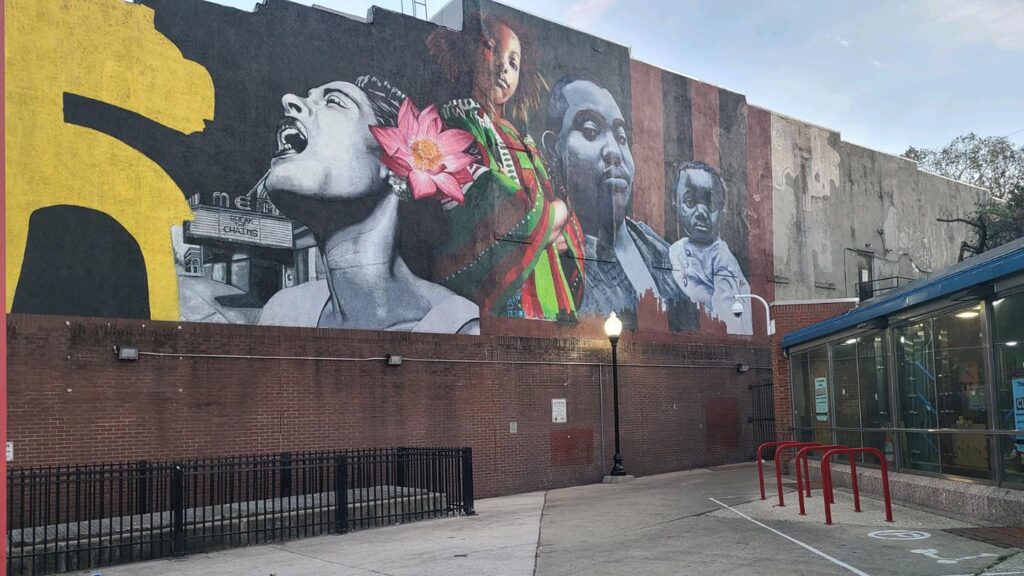
Locate an element on the screen. yellow paint is located at coordinates (166, 68), (83, 51), (35, 85), (35, 179), (112, 185), (155, 261).